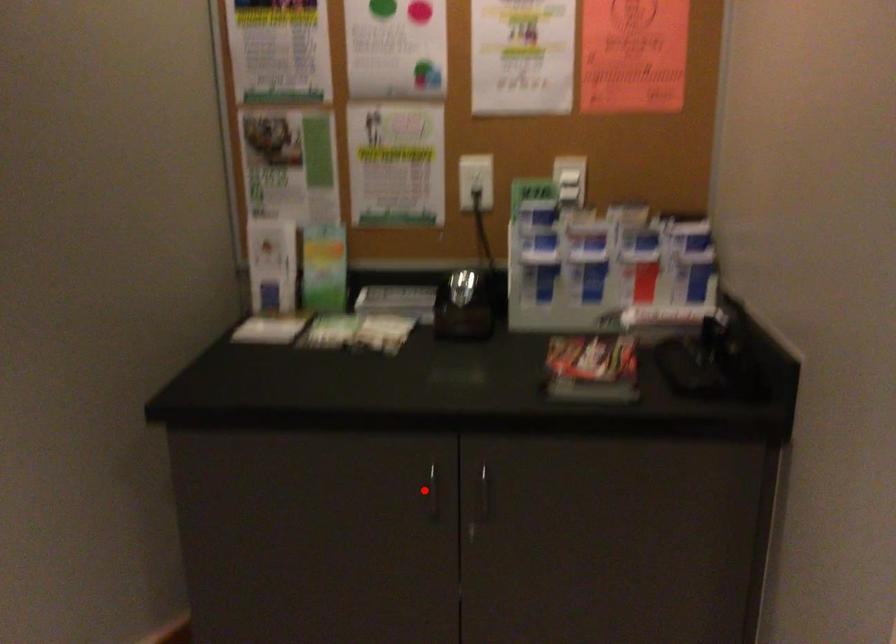
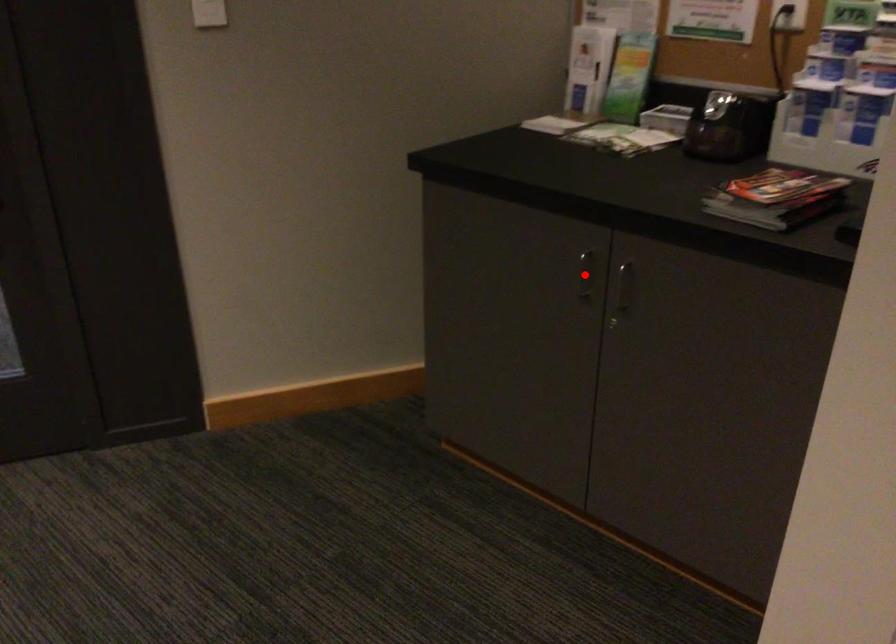
I am providing you with two images of the same scene from different viewpoints. A red point is marked on the first image and another point is marked on the second image. Does the point marked in image1 correspond to the same location as the one in image2?

Yes